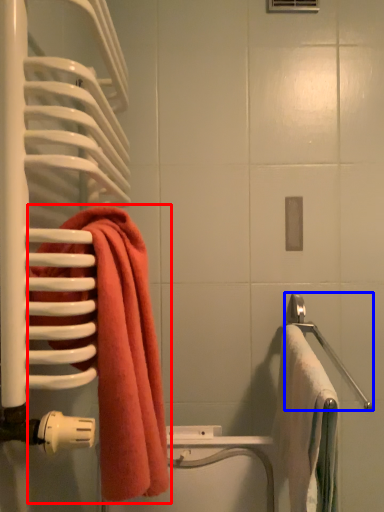
Question: Among these objects, which one is farthest to the camera, towel (highlighted by a red box) or towel bar (highlighted by a blue box)?

Choices:
 (A) towel
 (B) towel bar

Answer: (B)